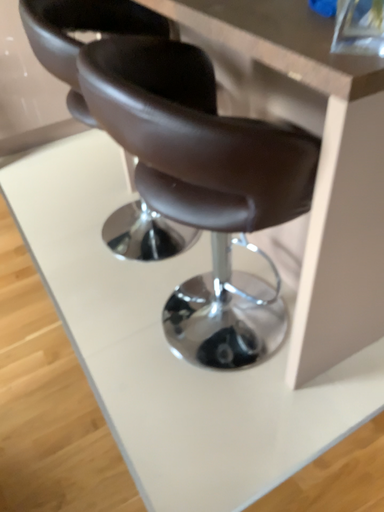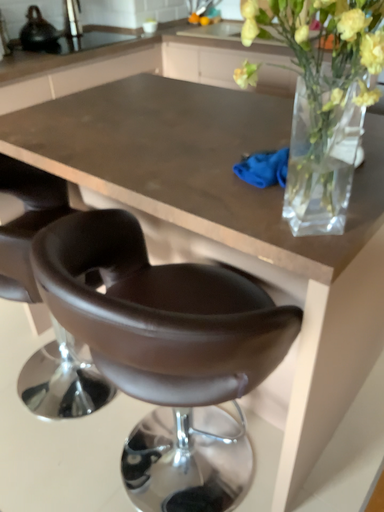
Question: Which way did the camera rotate in the video?

Choices:
 (A) rotated right
 (B) rotated left

Answer: (A)